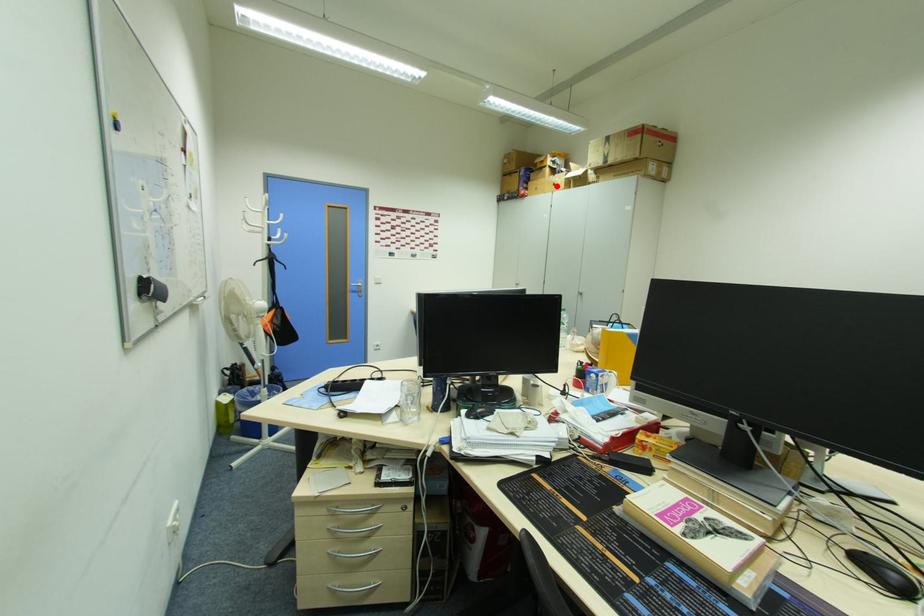
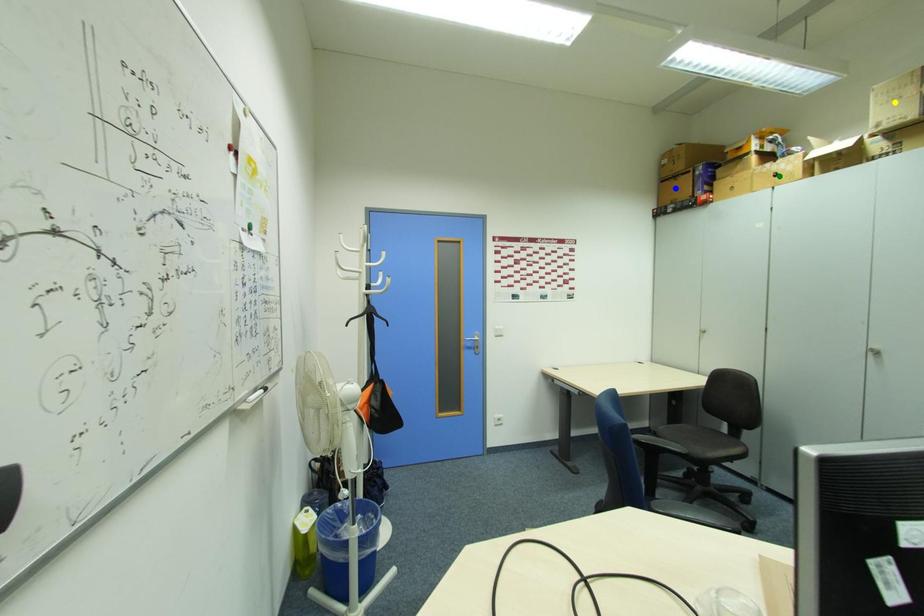
Question: I am providing you with two images of the same scene from different viewpoints. A red point is marked on the first image. You are given multiple points on the second image. Which spot in image 2 lines up with the point in image 1?

Choices:
 (A) green point
 (B) blue point
 (C) yellow point

Answer: (A)